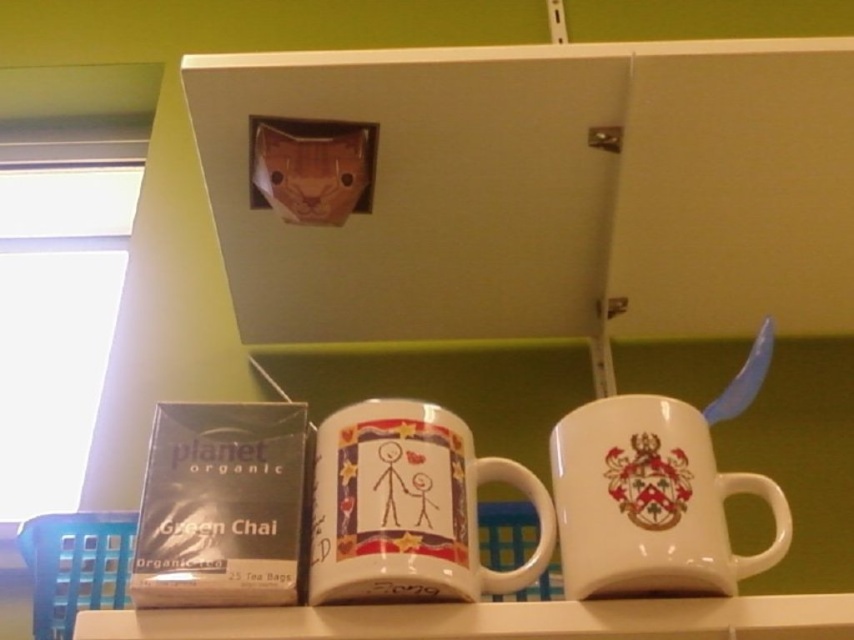
Question: Where is white ceramic mug at center located in relation to white glossy shelf at lower center in the image?

Choices:
 (A) left
 (B) right

Answer: (B)

Question: Is white ceramic mug at center positioned at the back of white glossy shelf at lower center?

Choices:
 (A) yes
 (B) no

Answer: (A)

Question: Which object appears closest to the camera in this image?

Choices:
 (A) matte ceramic mug at center
 (B) white ceramic mug at center

Answer: (A)

Question: Which point appears farthest from the camera in this image?

Choices:
 (A) (706, 604)
 (B) (575, 545)

Answer: (B)

Question: Estimate the real-world distances between objects in this image. Which object is closer to the white glossy shelf at lower center?

Choices:
 (A) white ceramic mug at center
 (B) matte ceramic mug at center

Answer: (B)

Question: Is the position of matte ceramic mug at center less distant than that of white glossy shelf at lower center?

Choices:
 (A) no
 (B) yes

Answer: (B)